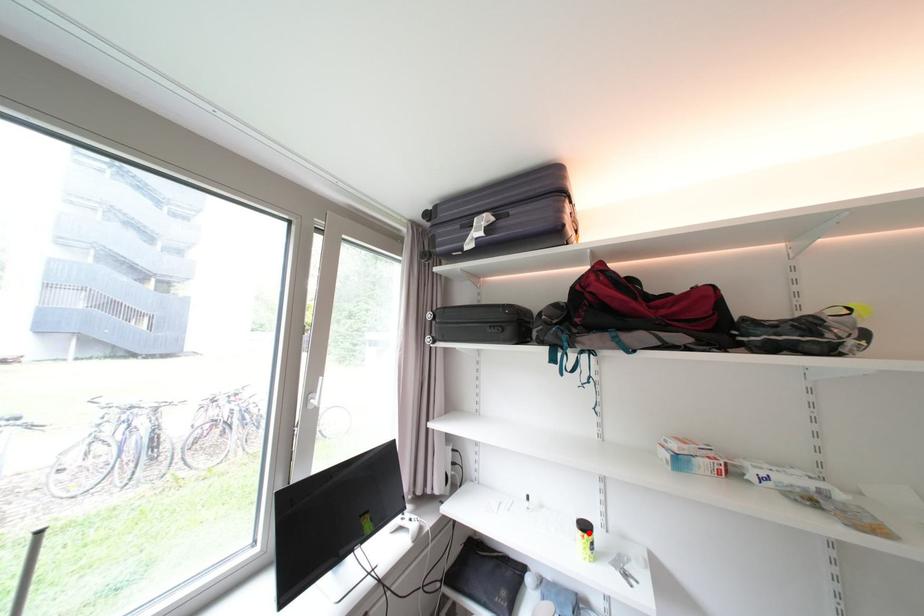
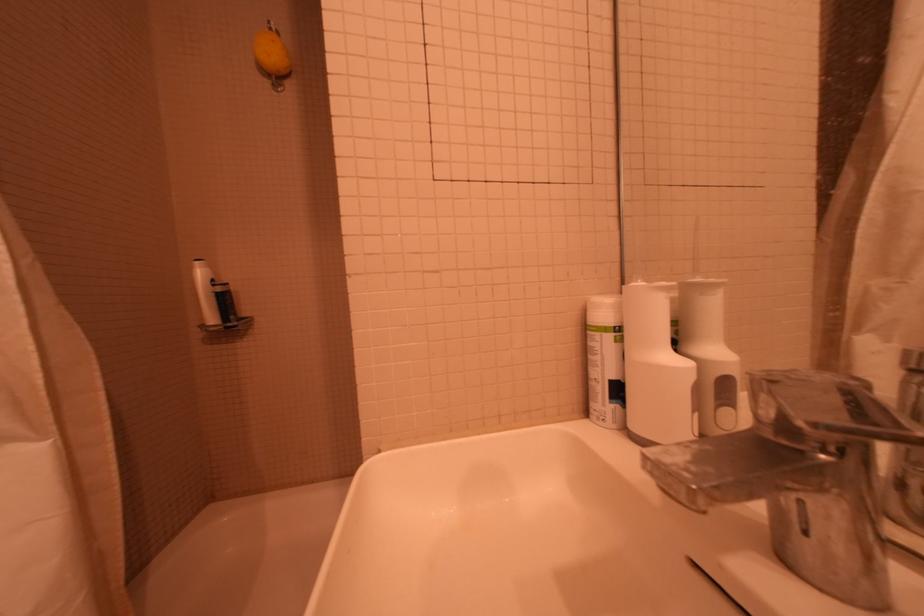
Question: I am providing you with two images of the same scene from different viewpoints. A red point is marked on the first image. Can you still see the location of the red point in image 2?

Choices:
 (A) Yes
 (B) No

Answer: (B)